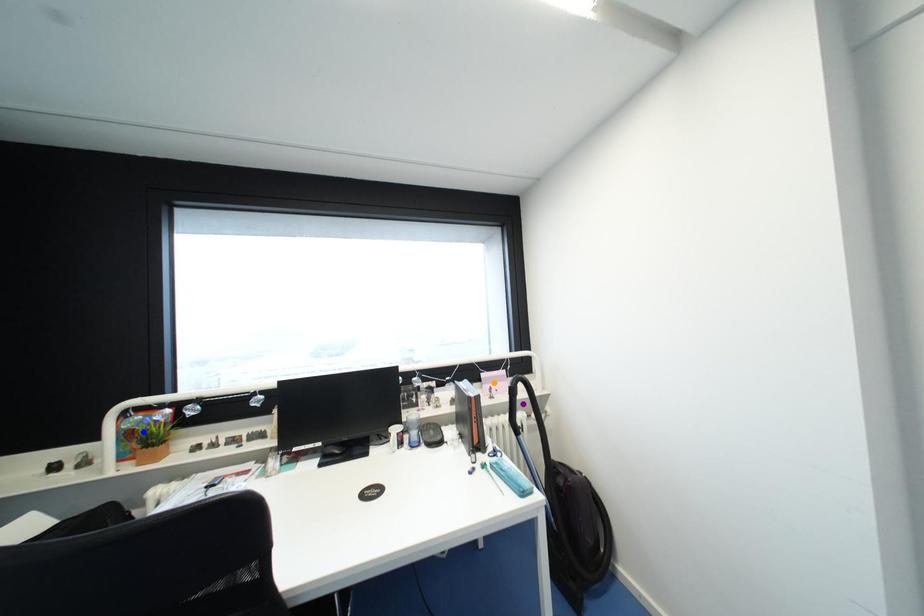
Order these from nearest to farthest:
purple point
orange point
blue point

blue point → purple point → orange point